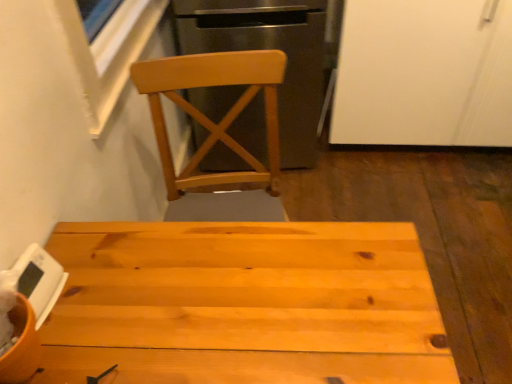
This screenshot has height=384, width=512. In order to click on free spot behind white matte digital clock at lower left in this screenshot , I will do `click(78, 243)`.